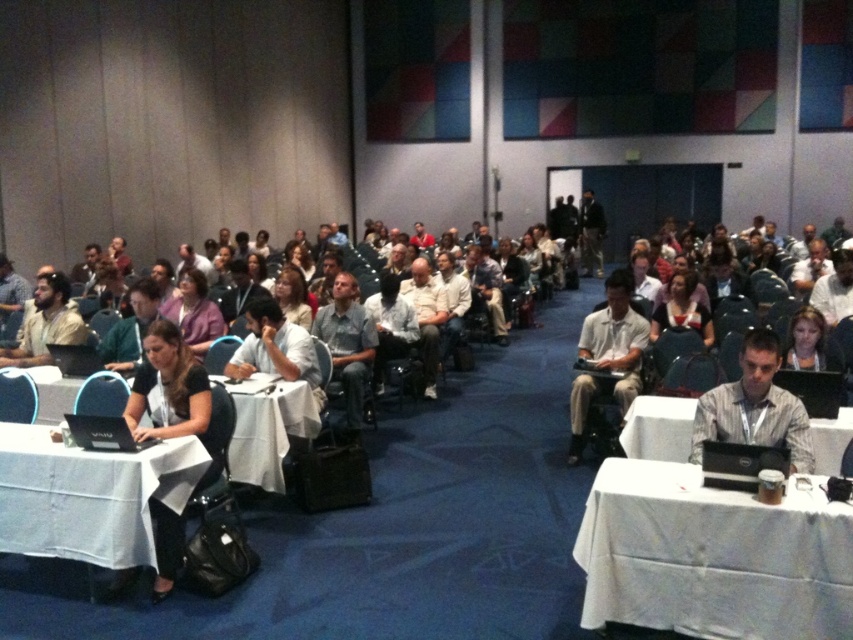
You are a photographer standing at the camera position. You want to take a photo of the white cloth table at center. Is the distance between you and the table sufficient to capture a clear, detailed image without using a zoom lens?

The distance between the white cloth table at center and the camera is 4.09 meters. Whether this distance is sufficient depends on the focal length of your lens. A standard lens might require zooming to capture detail clearly from this distance, but if your camera has a sufficiently high resolution or a lens with a long enough focal length, it could work without zoom. However, without specific lens details, it is hard to say definitively.